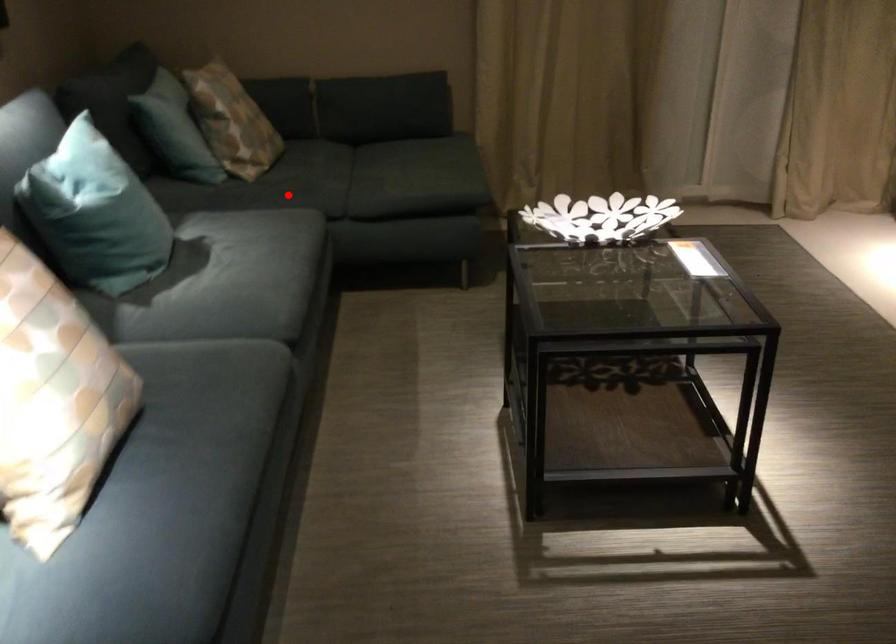
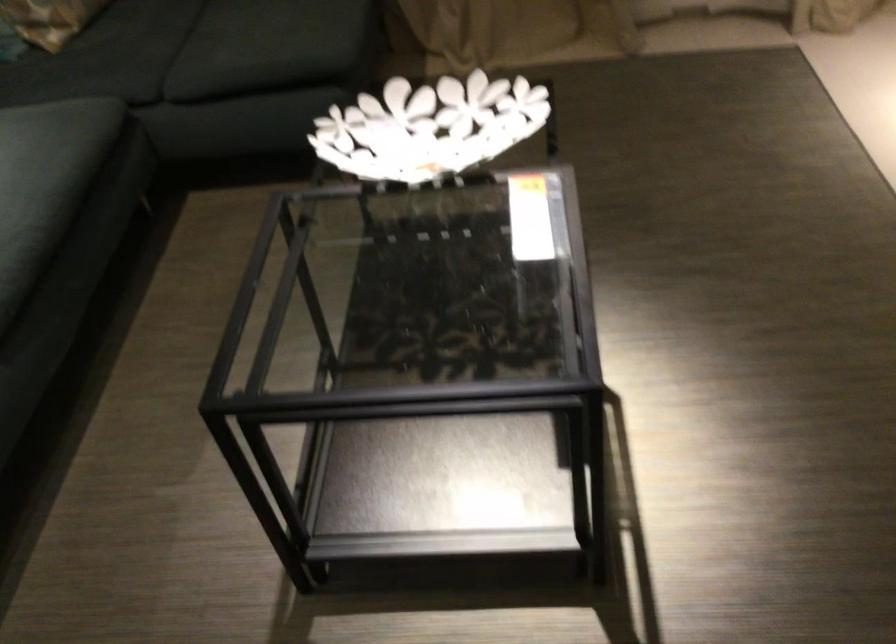
Question: I am providing you with two images of the same scene from different viewpoints. A red point is marked on the first image. At the location where the point appears in image 1, is it still visible in image 2?

Choices:
 (A) Yes
 (B) No

Answer: (A)